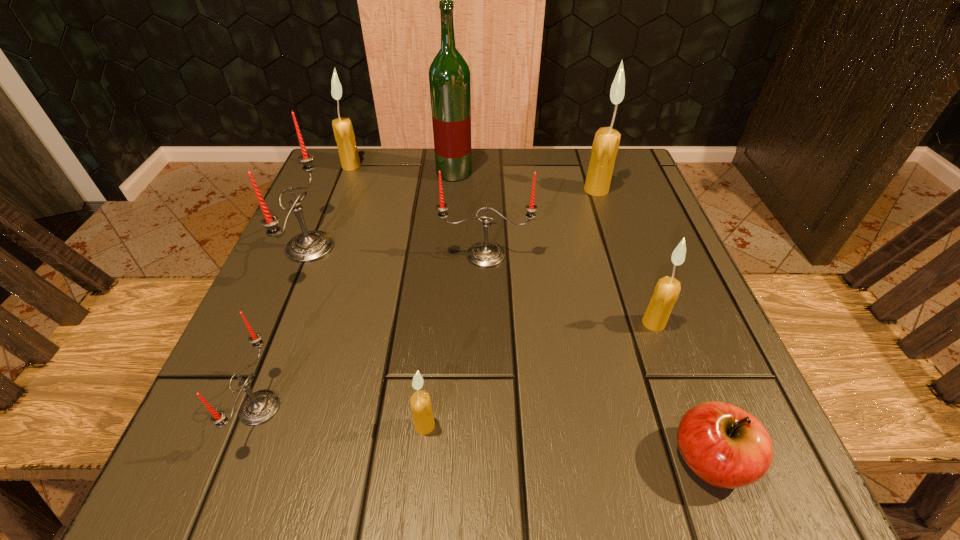
Locate an element on the screen. The width and height of the screenshot is (960, 540). the smallest cream candle is located at coordinates (421, 406).

Locate an element on the screen. the third cream candle from right to left is located at coordinates (421, 406).

I want to click on the smallest red candle, so click(x=259, y=407).

This screenshot has width=960, height=540. In order to click on apple in this screenshot , I will do `click(727, 447)`.

Identify the location of vacant space located 0.280m on the front of the liquor. The width and height of the screenshot is (960, 540). (446, 268).

You are a GUI agent. You are given a task and a screenshot of the screen. Output one action in this format:
    pyautogui.click(x=<x>, y=<y>)
    Task: Click on the free location located 0.130m on the back of the second tallest object
    The image size is (960, 540).
    Given the screenshot: What is the action you would take?
    pyautogui.click(x=585, y=153)

Image resolution: width=960 pixels, height=540 pixels. I want to click on vacant space located 0.270m on the right of the leftmost cream candle, so click(x=475, y=166).

Identify the location of vacant space located on the front-facing side of the biggest red candle. (508, 247).

Locate an element on the screen. This screenshot has width=960, height=540. vacant point located on the front-facing side of the rightmost red candle is located at coordinates (487, 301).

Identify the location of vacant space positioned 0.310m on the left of the fourth nearest object. (448, 323).